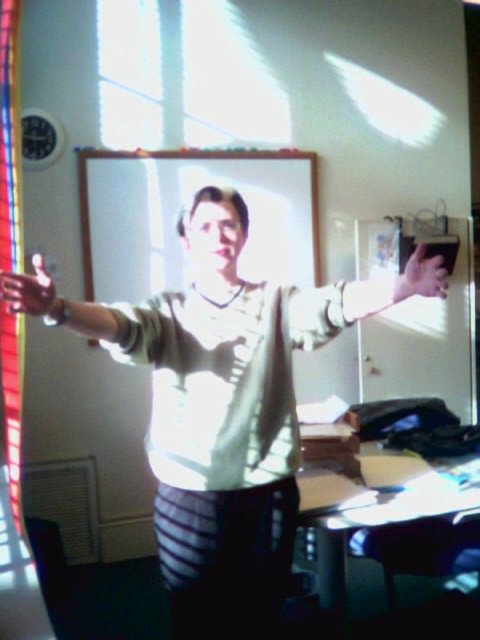
Between point (239, 538) and point (132, 348), which one is positioned behind?

Point (239, 538)

The image size is (480, 640). What are the coordinates of `white matte shirt at center` in the screenshot? It's located at (224, 417).

Between matte white shirt at center and matte black hand at left, which one appears on the left side from the viewer's perspective?

Positioned to the left is matte black hand at left.

Does matte white shirt at center have a greater height compared to matte black hand at left?

Yes.

You are a GUI agent. You are given a task and a screenshot of the screen. Output one action in this format:
    pyautogui.click(x=<x>, y=<y>)
    Task: Click on the matte white shirt at center
    The width and height of the screenshot is (480, 640).
    Given the screenshot: What is the action you would take?
    pyautogui.click(x=76, y=310)

I want to click on matte white shirt at center, so click(76, 310).

Is white matte shirt at center thinner than matte black hand at left?

No.

Between point (225, 481) and point (19, 276), which one is positioned behind?

The point (225, 481) is behind.

Identify the location of white matte shirt at center. (224, 417).